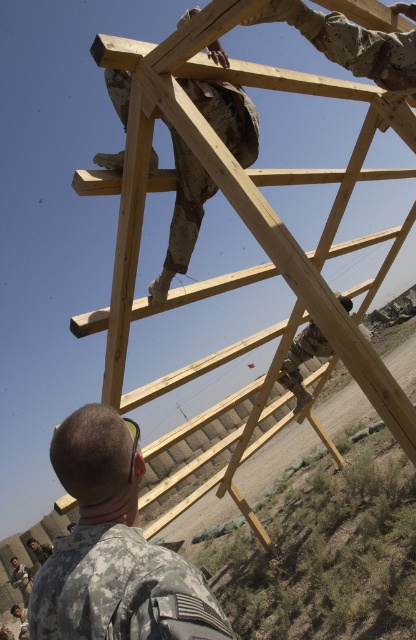
Which is below, light brown wooden ladder at upper center or camouflage fabric uniform at lower left?

camouflage fabric uniform at lower left

Identify the location of light brown wooden ladder at upper center. (250, 230).

Can you confirm if camouflage uniform at lower left is positioned below camouflage fabric soldier at lower right?

Yes.

Does camouflage uniform at lower left have a lesser height compared to camouflage fabric soldier at lower right?

Correct, camouflage uniform at lower left is not as tall as camouflage fabric soldier at lower right.

Locate an element on the screen. The width and height of the screenshot is (416, 640). camouflage uniform at lower left is located at coordinates (113, 548).

Is camouflage fabric uniform at lower left behind camouflage fabric soldier at lower right?

That is False.

This screenshot has width=416, height=640. I want to click on camouflage fabric uniform at lower left, so (121, 589).